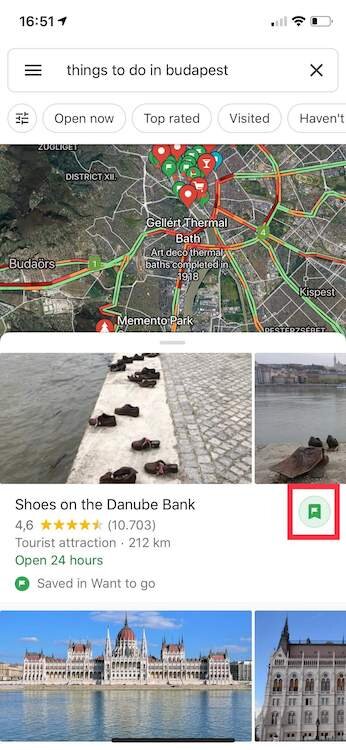
Image resolution: width=346 pixels, height=750 pixels. I want to click on circular windows, so click(x=279, y=674), click(x=292, y=676), click(x=308, y=675), click(x=325, y=674), click(x=341, y=674).